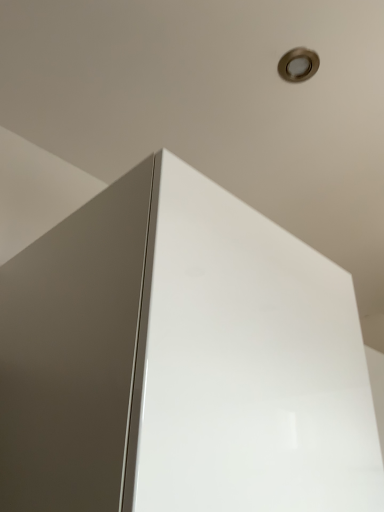
From the picture: What is the approximate width of white glossy cabinet at center?

The width of white glossy cabinet at center is 26.87 inches.

In the scene shown: What is the approximate height of white glossy cabinet at center?

20.27 inches.

Describe the element at coordinates (181, 360) in the screenshot. I see `white glossy cabinet at center` at that location.

Find the location of a particular element. white glossy cabinet at center is located at coordinates (181, 360).

At what (x,y) coordinates should I click in order to perform the action: click on white glossy cabinet at center. Please return your answer as a coordinate pair (x, y). The width and height of the screenshot is (384, 512). Looking at the image, I should click on (181, 360).